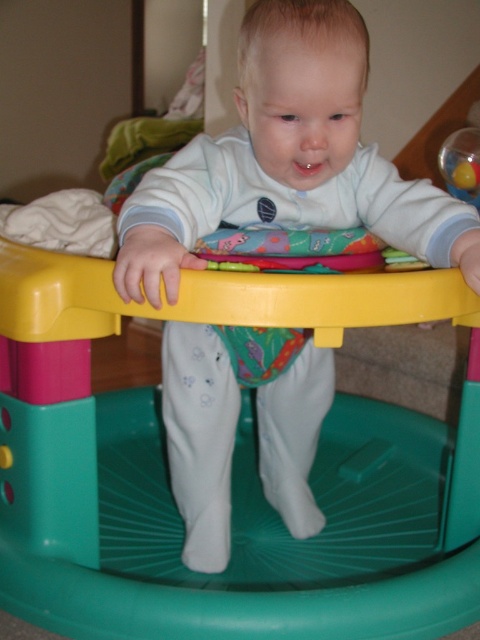
Question: Among these points, which one is farthest from the camera?

Choices:
 (A) (98, 275)
 (B) (312, 522)

Answer: (B)

Question: Observing the image, what is the correct spatial positioning of plastic walker at center in reference to white matte baby walker at center?

Choices:
 (A) left
 (B) right

Answer: (A)

Question: Is plastic walker at center above white matte baby walker at center?

Choices:
 (A) yes
 (B) no

Answer: (B)

Question: Does plastic walker at center have a smaller size compared to white matte baby walker at center?

Choices:
 (A) no
 (B) yes

Answer: (A)

Question: Which object is closer to the camera taking this photo?

Choices:
 (A) white matte baby walker at center
 (B) plastic walker at center

Answer: (A)